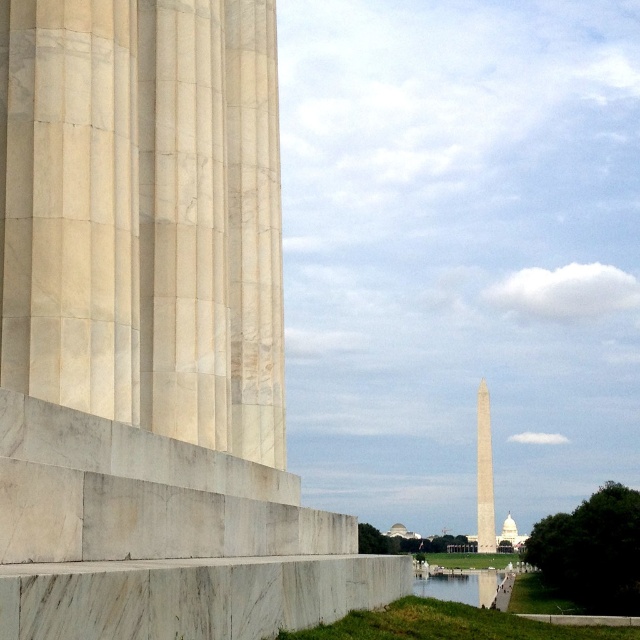
You are standing at the base of the Washington Monument and notice a point marked at coordinates (150, 333). Based on the scene description, can you identify which structure this point is located on?

The point marked at coordinates (150, 333) is located on the white marble column at left.

You are standing at the base of the Washington Monument and want to reach the observation deck located at point [259,301]. Given that the monument is 555 feet tall, can you estimate how much further you need to climb to reach the observation deck?

The distance between point [259,301] and the viewer is 99.93 feet. Since the total height of the monument is 555 feet, you need to climb an additional 555 minus 99.93 equals 455.07 feet to reach the observation deck.